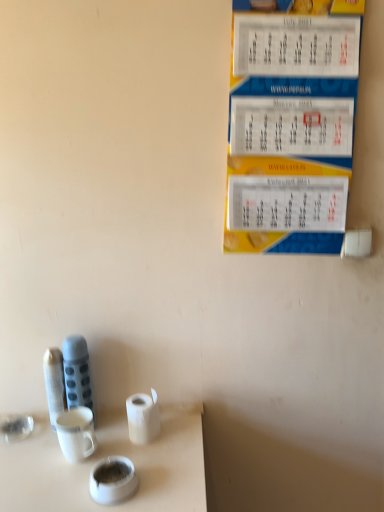
Question: Considering the positions of point (119, 465) and point (71, 387), is point (119, 465) closer or farther from the camera than point (71, 387)?

Choices:
 (A) farther
 (B) closer

Answer: (B)

Question: From a real-world perspective, relative to matte gray thermos at left, is white glossy teacup at lower center vertically above or below?

Choices:
 (A) above
 (B) below

Answer: (B)

Question: Which object is the closest to the white matte toilet paper at lower center?

Choices:
 (A) yellow paper calendar at upper right
 (B) white glossy teacup at lower center
 (C) matte gray thermos at left

Answer: (B)

Question: Based on their relative distances, which object is farther from the white matte toilet paper at lower center?

Choices:
 (A) yellow paper calendar at upper right
 (B) matte gray thermos at left
 (C) white glossy teacup at lower center

Answer: (A)